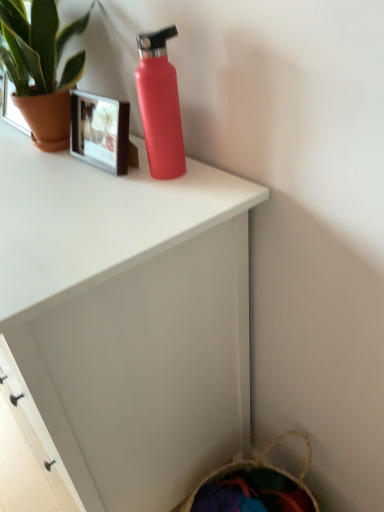
Image resolution: width=384 pixels, height=512 pixels. I want to click on free space in front of matte pink bottle at upper center, so click(x=154, y=203).